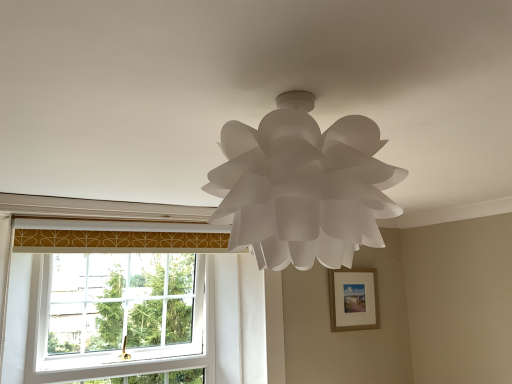
Question: Is white plastic window at lower left in front of white paper lamp at center?

Choices:
 (A) yes
 (B) no

Answer: (B)

Question: Is white paper lamp at center a part of white plastic window at lower left?

Choices:
 (A) yes
 (B) no

Answer: (B)

Question: From the image's perspective, does white plastic window at lower left appear lower than white paper lamp at center?

Choices:
 (A) yes
 (B) no

Answer: (A)

Question: Does white plastic window at lower left touch white paper lamp at center?

Choices:
 (A) yes
 (B) no

Answer: (B)

Question: From a real-world perspective, does white plastic window at lower left stand above white paper lamp at center?

Choices:
 (A) no
 (B) yes

Answer: (A)

Question: Can you confirm if white plastic window at lower left is thinner than white paper lamp at center?

Choices:
 (A) no
 (B) yes

Answer: (B)

Question: Would you consider wooden picture frame at center-right to be distant from white plastic window at lower left?

Choices:
 (A) yes
 (B) no

Answer: (A)

Question: From a real-world perspective, is wooden picture frame at center-right physically below white plastic window at lower left?

Choices:
 (A) yes
 (B) no

Answer: (B)

Question: Is white plastic window at lower left at the back of wooden picture frame at center-right?

Choices:
 (A) no
 (B) yes

Answer: (A)

Question: Is wooden picture frame at center-right oriented towards white plastic window at lower left?

Choices:
 (A) no
 (B) yes

Answer: (A)

Question: Can you confirm if wooden picture frame at center-right is positioned to the right of white plastic window at lower left?

Choices:
 (A) yes
 (B) no

Answer: (A)

Question: Is the surface of wooden picture frame at center-right in direct contact with white plastic window at lower left?

Choices:
 (A) yes
 (B) no

Answer: (B)

Question: Considering the relative positions of wooden picture frame at center-right and white paper lamp at center in the image provided, is wooden picture frame at center-right to the right of white paper lamp at center from the viewer's perspective?

Choices:
 (A) no
 (B) yes

Answer: (B)